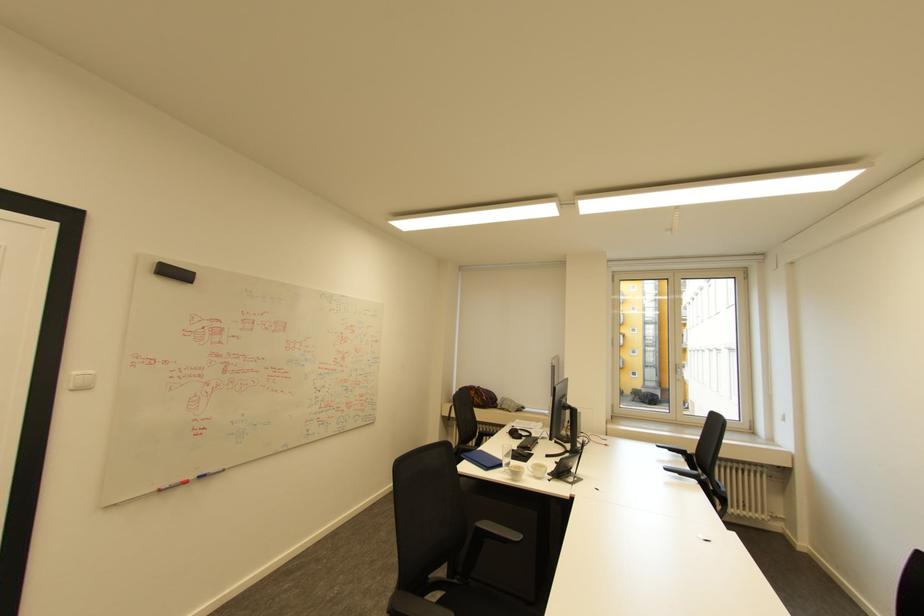
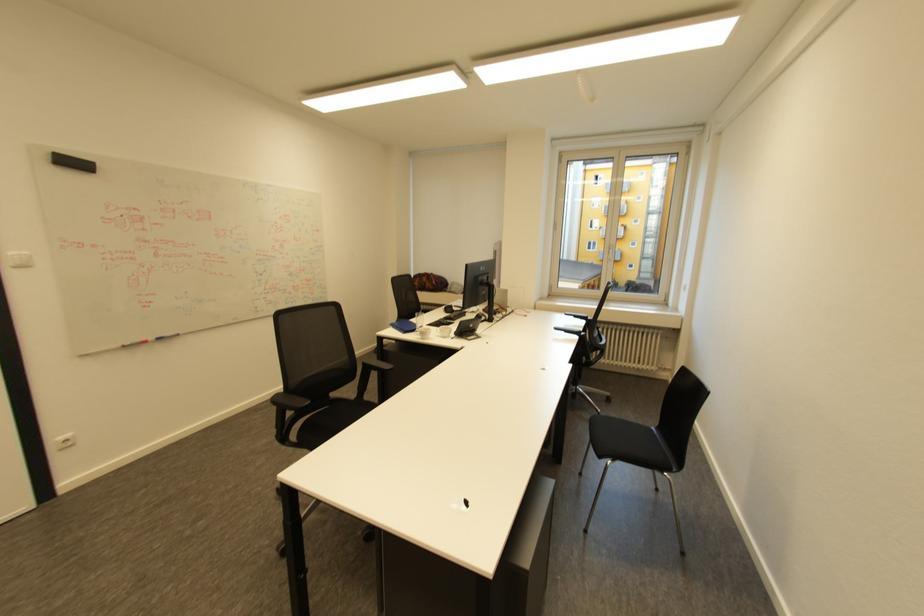
Locate, in the second image, the point that corresponds to point 98,371 in the first image.

(30, 253)